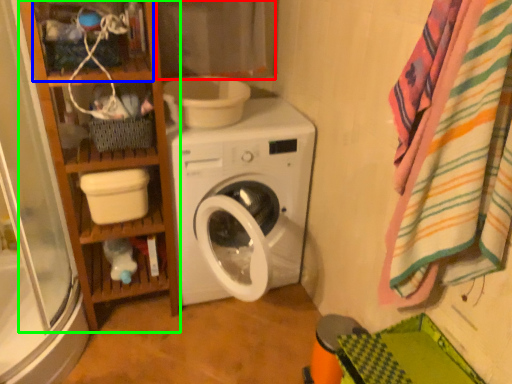
Question: Considering the real-world distances, which object is farthest from curtain (highlighted by a red box)? shelf (highlighted by a blue box) or bookshelf (highlighted by a green box)?

Choices:
 (A) shelf
 (B) bookshelf

Answer: (B)